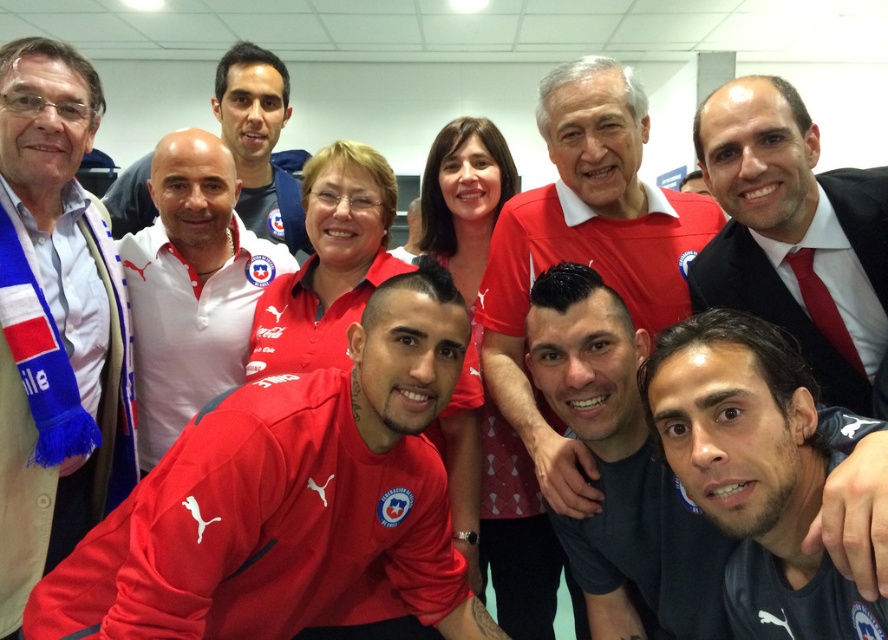
You are standing in the room and want to hand a gift to the person wearing the matte red jersey at center. Based on their position, which direction should you move to reach them?

The matte red jersey at center is located at point [290,499], so you should move towards the center of the room to reach them.

You are a photographer trying to capture a clear shot of the dark blue jersey at center without the matte red shirt at center blocking it. Based on the scene description, what adjustment should you make to your camera angle?

The dark blue jersey at center is behind the matte red shirt at center, so to avoid the matte red shirt at center blocking the view, you should adjust your camera angle to look from behind the matte red shirt at center or move your position to the side where the dark blue jersey at center is more visible.

In the scene described, there are two shirts at the center of the image. The matte red shirt at center and the white matte shirt at center. Which shirt is positioned lower in the image?

The matte red shirt at center is located below the white matte shirt at center, so the matte red shirt at center is positioned lower in the image.